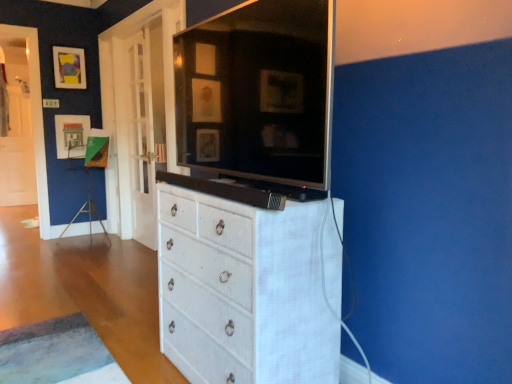
The width and height of the screenshot is (512, 384). What do you see at coordinates (71, 135) in the screenshot?
I see `matte paper picture frame at upper left, which appears as the first picture frame when ordered from the bottom` at bounding box center [71, 135].

At what (x,y) coordinates should I click in order to perform the action: click on matte paper picture frame at upper left, which appears as the first picture frame when ordered from the bottom. Please return your answer as a coordinate pair (x, y). This screenshot has width=512, height=384. Looking at the image, I should click on (71, 135).

Locate an element on the screen. This screenshot has width=512, height=384. white textured cabinet at center is located at coordinates (258, 95).

The width and height of the screenshot is (512, 384). Describe the element at coordinates (69, 68) in the screenshot. I see `matte black picture frame at upper left, which is the 2th picture frame from bottom to top` at that location.

What do you see at coordinates (243, 291) in the screenshot?
I see `white wicker chest of drawers at center` at bounding box center [243, 291].

Describe the element at coordinates (136, 140) in the screenshot. I see `white glass door at left` at that location.

Find the location of `matte paper picture frame at upper left, which appears as the first picture frame when ordered from the bottom`. matte paper picture frame at upper left, which appears as the first picture frame when ordered from the bottom is located at coordinates (71, 135).

Is white textured cabinet at center positioned beyond the bounds of matte paper picture frame at upper left, which appears as the first picture frame when ordered from the bottom?

That's correct, white textured cabinet at center is outside of matte paper picture frame at upper left, which appears as the first picture frame when ordered from the bottom.

Locate an element on the screen. The height and width of the screenshot is (384, 512). tv cabinet below the matte paper picture frame at upper left, which appears as the first picture frame when ordered from the bottom (from the image's perspective) is located at coordinates (258, 95).

From a real-world perspective, which object stands above the other?

From a 3D spatial view, white textured cabinet at center is above.

From the image's perspective, between white textured cabinet at center and matte paper picture frame at upper left, which is the second picture frame from top to bottom, which one is located above?

matte paper picture frame at upper left, which is the second picture frame from top to bottom, is shown above in the image.

In the scene shown: Considering the relative positions of white textured cabinet at center and white glass door at left in the image provided, is white textured cabinet at center to the left of white glass door at left from the viewer's perspective?

No, white textured cabinet at center is not to the left of white glass door at left.

From a real-world perspective, which is physically above, white textured cabinet at center or white glass door at left?

From a 3D spatial view, white textured cabinet at center is above.

From the image's perspective, is white textured cabinet at center above or below white glass door at left?

white textured cabinet at center is below white glass door at left.

Considering the relative sizes of white textured cabinet at center and white glass door at left in the image provided, is white textured cabinet at center taller than white glass door at left?

No.

Which point is more distant from viewer, (116, 101) or (87, 121)?

The point (87, 121) is farther from the camera.

Is white glass door at left beside matte paper picture frame at upper left, which appears as the first picture frame when ordered from the bottom?

No, white glass door at left is not with matte paper picture frame at upper left, which appears as the first picture frame when ordered from the bottom.

Which of these two, white glass door at left or matte paper picture frame at upper left, which appears as the first picture frame when ordered from the bottom, is smaller?

matte paper picture frame at upper left, which appears as the first picture frame when ordered from the bottom.

Find the location of a particular element. This screenshot has height=384, width=512. the 1st picture frame counting from the left of the white glass door at left is located at coordinates (71, 135).

From the image's perspective, which one is positioned lower, white wicker chest of drawers at center or white glass door at left?

From the image's view, white wicker chest of drawers at center is below.

How different are the orientations of white wicker chest of drawers at center and white glass door at left in degrees?

1.33 degrees separate the facing orientations of white wicker chest of drawers at center and white glass door at left.

Are white wicker chest of drawers at center and white glass door at left far apart?

white wicker chest of drawers at center is positioned a significant distance from white glass door at left.

Would you say matte paper picture frame at upper left, which is the second picture frame from top to bottom, is a long distance from matte black picture frame at upper left, marked as the first picture frame in a top-to-bottom arrangement?

That's not correct — matte paper picture frame at upper left, which is the second picture frame from top to bottom, is a little close to matte black picture frame at upper left, marked as the first picture frame in a top-to-bottom arrangement.

Is matte paper picture frame at upper left, which appears as the first picture frame when ordered from the bottom, positioned with its back to matte black picture frame at upper left, marked as the first picture frame in a top-to-bottom arrangement?

→ matte paper picture frame at upper left, which appears as the first picture frame when ordered from the bottom, is not turned away from matte black picture frame at upper left, marked as the first picture frame in a top-to-bottom arrangement.

Does matte paper picture frame at upper left, which appears as the first picture frame when ordered from the bottom, have a larger size compared to matte black picture frame at upper left, marked as the first picture frame in a top-to-bottom arrangement?

Yes.

Considering their positions, is matte paper picture frame at upper left, which appears as the first picture frame when ordered from the bottom, located in front of or behind matte black picture frame at upper left, which is the 2th picture frame from bottom to top?

Clearly, matte paper picture frame at upper left, which appears as the first picture frame when ordered from the bottom, is behind matte black picture frame at upper left, which is the 2th picture frame from bottom to top.

In the image, is matte black picture frame at upper left, marked as the first picture frame in a top-to-bottom arrangement, on the left side or the right side of matte paper picture frame at upper left, which appears as the first picture frame when ordered from the bottom?

From the image, it's evident that matte black picture frame at upper left, marked as the first picture frame in a top-to-bottom arrangement, is to the left of matte paper picture frame at upper left, which appears as the first picture frame when ordered from the bottom.

From the image's perspective, which one is positioned higher, matte black picture frame at upper left, marked as the first picture frame in a top-to-bottom arrangement, or matte paper picture frame at upper left, which is the second picture frame from top to bottom?

matte black picture frame at upper left, marked as the first picture frame in a top-to-bottom arrangement.

Where is `picture frame above the matte paper picture frame at upper left, which appears as the first picture frame when ordered from the bottom (from the image's perspective)`? picture frame above the matte paper picture frame at upper left, which appears as the first picture frame when ordered from the bottom (from the image's perspective) is located at coordinates (69, 68).

Does matte black picture frame at upper left, which is the 2th picture frame from bottom to top, turn towards matte paper picture frame at upper left, which appears as the first picture frame when ordered from the bottom?

No, matte black picture frame at upper left, which is the 2th picture frame from bottom to top, is not facing towards matte paper picture frame at upper left, which appears as the first picture frame when ordered from the bottom.

Which of these two, matte paper picture frame at upper left, which appears as the first picture frame when ordered from the bottom, or white glass door at left, is thinner?

white glass door at left.

Is matte paper picture frame at upper left, which appears as the first picture frame when ordered from the bottom, oriented towards white glass door at left?

Yes, matte paper picture frame at upper left, which appears as the first picture frame when ordered from the bottom, is oriented towards white glass door at left.

Is matte paper picture frame at upper left, which appears as the first picture frame when ordered from the bottom, positioned far away from white glass door at left?

Actually, matte paper picture frame at upper left, which appears as the first picture frame when ordered from the bottom, and white glass door at left are a little close together.

Which of these two, matte paper picture frame at upper left, which is the second picture frame from top to bottom, or white glass door at left, is bigger?

white glass door at left.

Find the location of a particular element. The width and height of the screenshot is (512, 384). picture frame that is the 2nd object located behind the white textured cabinet at center is located at coordinates (71, 135).

Where is `door above the white textured cabinet at center (from the image's perspective)`? This screenshot has height=384, width=512. door above the white textured cabinet at center (from the image's perspective) is located at coordinates (136, 140).

Based on their spatial positions, is white wicker chest of drawers at center or white textured cabinet at center further from matte paper picture frame at upper left, which appears as the first picture frame when ordered from the bottom?

Based on the image, white wicker chest of drawers at center appears to be further to matte paper picture frame at upper left, which appears as the first picture frame when ordered from the bottom.

Looking at the image, which one is located closer to white wicker chest of drawers at center, white glass door at left or matte black picture frame at upper left, which is the 2th picture frame from bottom to top?

white glass door at left is positioned closer to the anchor white wicker chest of drawers at center.

Looking at the image, which one is located closer to white glass door at left, white textured cabinet at center or white wicker chest of drawers at center?

Based on the image, white textured cabinet at center appears to be nearer to white glass door at left.

Considering their positions, is matte black picture frame at upper left, which is the 2th picture frame from bottom to top, positioned closer to white textured cabinet at center than matte paper picture frame at upper left, which appears as the first picture frame when ordered from the bottom?

matte paper picture frame at upper left, which appears as the first picture frame when ordered from the bottom, lies closer to white textured cabinet at center than the other object.

Looking at the image, which one is located further to matte paper picture frame at upper left, which is the second picture frame from top to bottom, matte black picture frame at upper left, which is the 2th picture frame from bottom to top, or white wicker chest of drawers at center?

white wicker chest of drawers at center lies further to matte paper picture frame at upper left, which is the second picture frame from top to bottom, than the other object.

Estimate the real-world distances between objects in this image. Which object is further from matte paper picture frame at upper left, which appears as the first picture frame when ordered from the bottom, white glass door at left or white wicker chest of drawers at center?

Among the two, white wicker chest of drawers at center is located further to matte paper picture frame at upper left, which appears as the first picture frame when ordered from the bottom.

Based on their spatial positions, is matte paper picture frame at upper left, which is the second picture frame from top to bottom, or white textured cabinet at center further from white wicker chest of drawers at center?

Among the two, matte paper picture frame at upper left, which is the second picture frame from top to bottom, is located further to white wicker chest of drawers at center.

Estimate the real-world distances between objects in this image. Which object is closer to white textured cabinet at center, matte paper picture frame at upper left, which is the second picture frame from top to bottom, or white wicker chest of drawers at center?

Among the two, white wicker chest of drawers at center is located nearer to white textured cabinet at center.

At what (x,y) coordinates should I click in order to perform the action: click on door between white textured cabinet at center and matte black picture frame at upper left, which is the 2th picture frame from bottom to top, in the front-back direction. Please return your answer as a coordinate pair (x, y). The image size is (512, 384). Looking at the image, I should click on (136, 140).

I want to click on door between white wicker chest of drawers at center and matte paper picture frame at upper left, which is the second picture frame from top to bottom, from front to back, so click(136, 140).

Image resolution: width=512 pixels, height=384 pixels. Identify the location of door positioned between white textured cabinet at center and matte paper picture frame at upper left, which is the second picture frame from top to bottom, from near to far. (136, 140).

The height and width of the screenshot is (384, 512). I want to click on door between white wicker chest of drawers at center and matte black picture frame at upper left, marked as the first picture frame in a top-to-bottom arrangement, from front to back, so point(136,140).